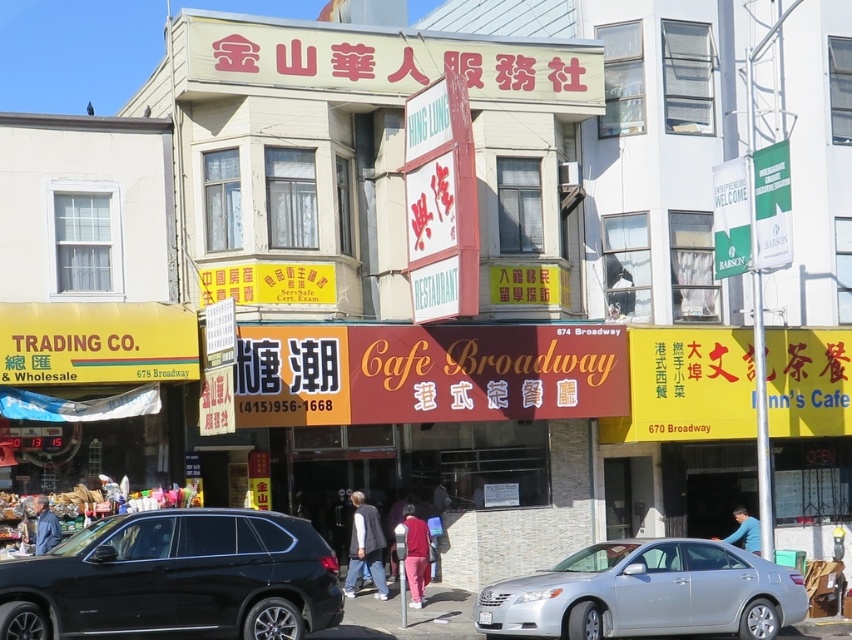
Question: Which point is closer to the camera?

Choices:
 (A) dark blue jacket at lower left
 (B) matte pink pants at center
 (C) blue fabric shirt at lower right

Answer: (B)

Question: Is matte pink pants at center behind dark blue jacket at lower left?

Choices:
 (A) no
 (B) yes

Answer: (A)

Question: Which is nearer to the dark blue jacket at lower left?

Choices:
 (A) shiny black suv at lower left
 (B) dark gray sweater at center
 (C) silver metallic sedan at center
 (D) blue fabric shirt at lower right

Answer: (B)

Question: Where is silver metallic sedan at center located in relation to dark gray sweater at center in the image?

Choices:
 (A) below
 (B) above

Answer: (A)

Question: Which object is the closest to the blue fabric shirt at lower right?

Choices:
 (A) matte pink pants at center
 (B) dark blue jacket at lower left
 (C) shiny black suv at lower left

Answer: (A)

Question: Can you confirm if matte pink pants at center is positioned above blue fabric shirt at lower right?

Choices:
 (A) no
 (B) yes

Answer: (B)